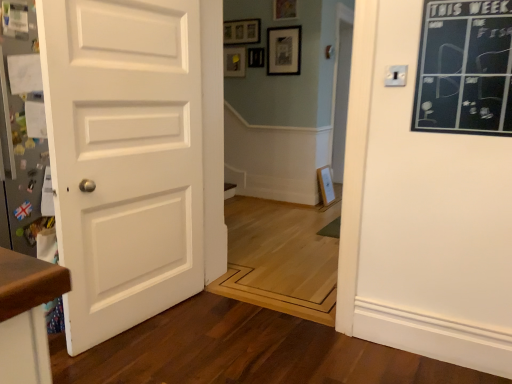
You are a GUI agent. You are given a task and a screenshot of the screen. Output one action in this format:
    pyautogui.click(x=<x>, y=<y>)
    Task: Click on the free spot in front of white matte door at left
    
    Given the screenshot: What is the action you would take?
    pyautogui.click(x=157, y=355)